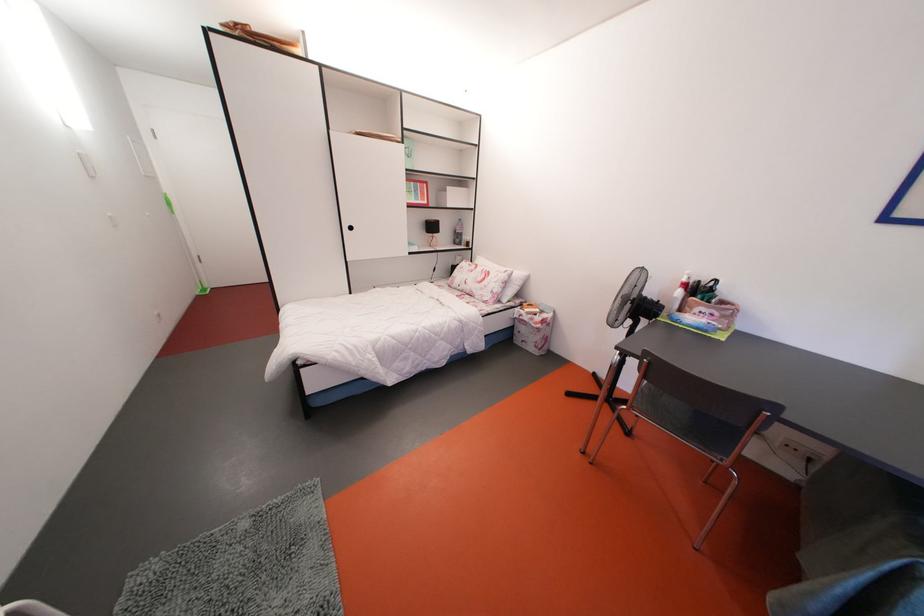
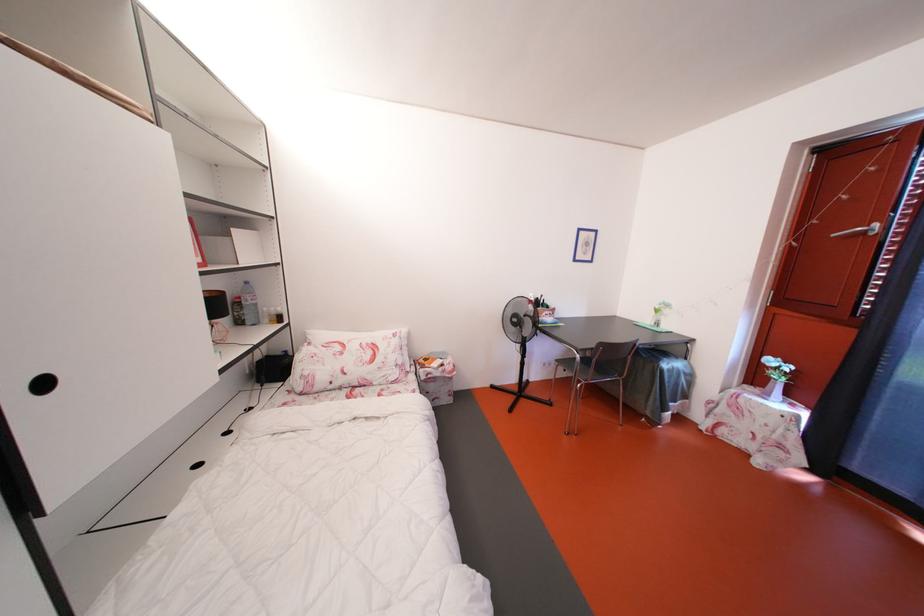
Where in the second image is the point corresponding to pixel 690 285 from the first image?

(540, 305)